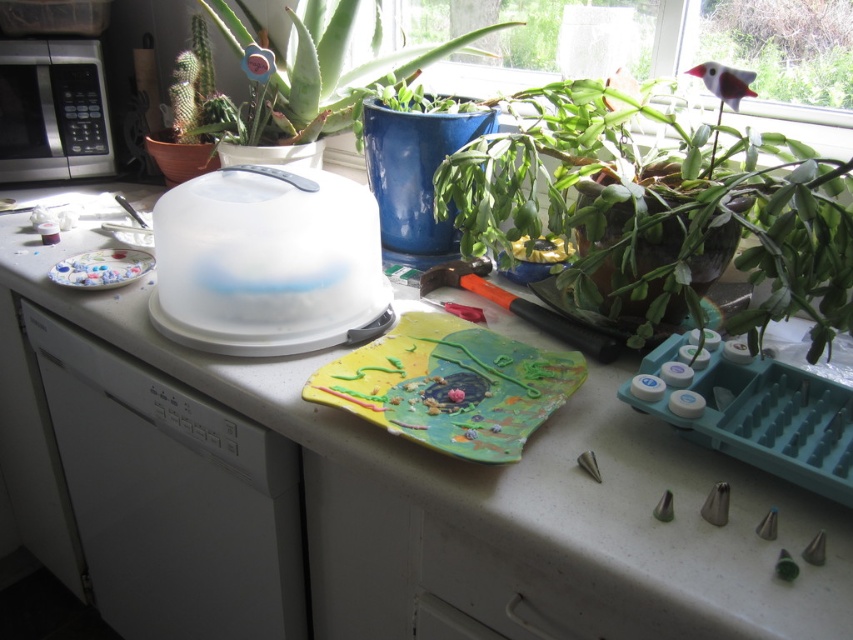
Can you confirm if white plastic tray at center is positioned to the right of leathery green plant at center right?

No, white plastic tray at center is not to the right of leathery green plant at center right.

Is point (792, 611) positioned before point (682, 307)?

Yes, point (792, 611) is in front of point (682, 307).

Locate an element on the screen. Image resolution: width=853 pixels, height=640 pixels. white plastic tray at center is located at coordinates (529, 481).

Does leathery green plant at center right appear under green matte aloe vera at upper center?

Yes.

Who is more distant from viewer, [498,168] or [288,122]?

Positioned behind is point [288,122].

Does point (640, 209) come farther from viewer compared to point (288, 76)?

No.

Identify the location of leathery green plant at center right. (659, 205).

Which is more to the right, transparent glass window at upper center or green matte aloe vera at upper center?

Positioned to the right is transparent glass window at upper center.

Does point (596, 72) come behind point (321, 65)?

Yes.

What do you see at coordinates (663, 42) in the screenshot? The height and width of the screenshot is (640, 853). I see `transparent glass window at upper center` at bounding box center [663, 42].

The image size is (853, 640). Identify the location of transparent glass window at upper center. (663, 42).